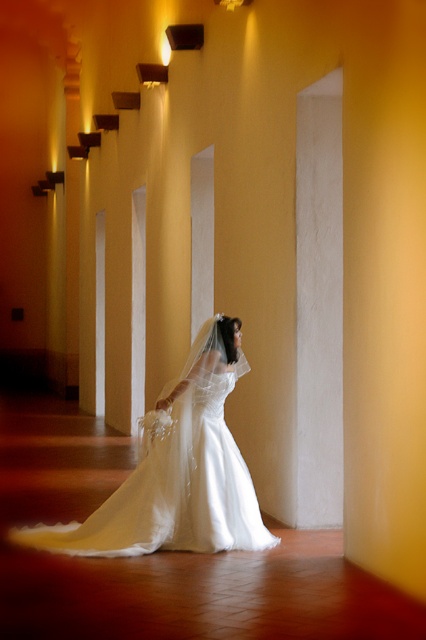
From the picture: You are a photographer positioned at the end of the corridor. You need to capture a shot of the white satin dress at center and the white marble pillar at center. Which object is wider?

The white satin dress at center is wider than the white marble pillar at center.

You are a photographer positioned at the end of the corridor. You want to capture a shot of the white satin dress at center and the white marble pillar at center such that the dress is on the left side of the pillar in the frame. Based on the scene, will this arrangement naturally occur without any adjustments?

Yes, the white satin dress at center is already positioned to the left of the white marble pillar at center, so this arrangement will naturally occur without adjustments.

In the scene shown: You are a photographer positioned at the end of the corridor. The bride in the white satin dress at center is 6.86 meters away from you. You need to capture a photo of her from your current position. Considering the corridor has a depth of field that can focus clearly up to 6 meters, will the bride appear in focus in the photo?

The white satin dress at center is 6.86 meters away from the photographer. Since the depth of field can only focus clearly up to 6 meters, the bride will be slightly out of focus in the photo.